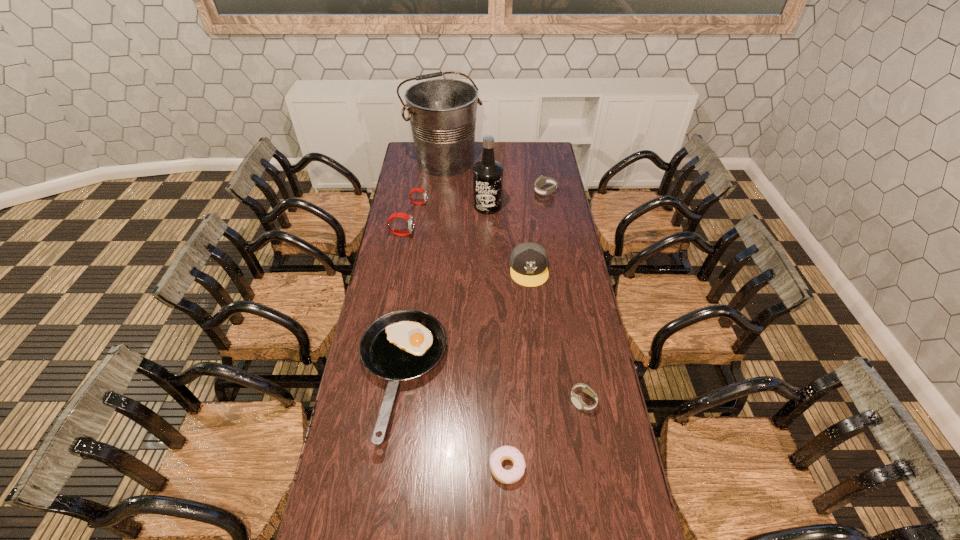
This screenshot has width=960, height=540. I want to click on vacant space located 0.070m on the face of the farther white watch, so click(x=521, y=192).

This screenshot has height=540, width=960. Identify the location of vacant space located on the face of the farther white watch. (512, 192).

The height and width of the screenshot is (540, 960). In order to click on vacant space situated on the face of the farther white watch in this screenshot , I will do `click(472, 192)`.

Image resolution: width=960 pixels, height=540 pixels. I want to click on free region located 0.160m on the right of the frying pan, so click(x=491, y=377).

This screenshot has height=540, width=960. I want to click on vacant point located 0.070m on the face of the smaller white watch, so click(588, 433).

Image resolution: width=960 pixels, height=540 pixels. I want to click on free space located on the left of the doughnut, so click(x=412, y=468).

The height and width of the screenshot is (540, 960). In order to click on object located at the far edge in this screenshot , I will do `click(414, 539)`.

The width and height of the screenshot is (960, 540). What are the coordinates of `bucket at the left edge` in the screenshot? It's located at point(414,539).

I want to click on frying pan that is at the left edge, so click(x=396, y=539).

Locate an element on the screen. cap located in the right edge section of the desktop is located at coordinates (414, 539).